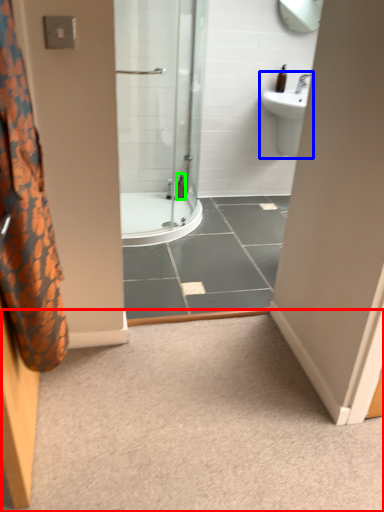
Question: Which object is the closest to the plain (highlighted by a red box)? Choose among these: sink (highlighted by a blue box) or toiletry (highlighted by a green box).

Choices:
 (A) sink
 (B) toiletry

Answer: (B)